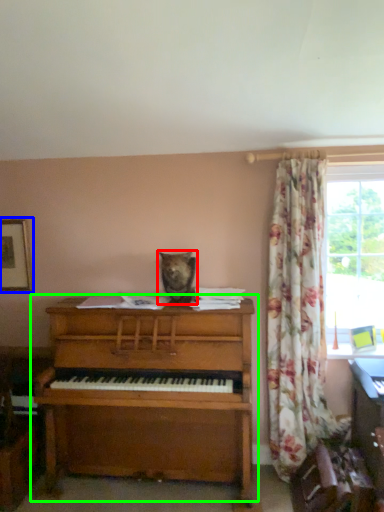
Question: Which object is the farthest from animal (highlighted by a red box)? Choose among these: picture frame (highlighted by a blue box) or piano (highlighted by a green box).

Choices:
 (A) picture frame
 (B) piano

Answer: (A)